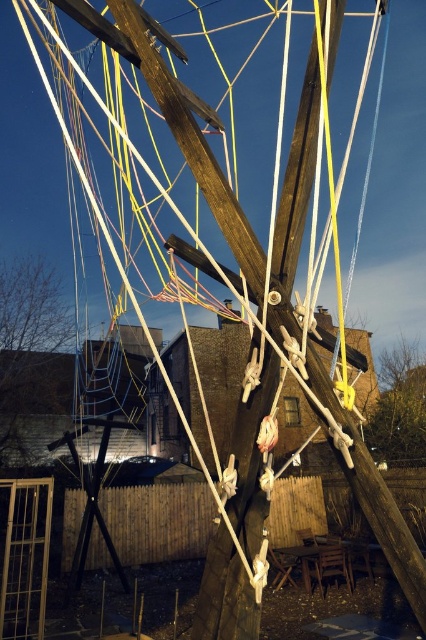
Question: Is the position of green matte tree at lower left more distant than that of wooden swing at right?

Choices:
 (A) no
 (B) yes

Answer: (B)

Question: Is green matte tree at lower left to the right of wooden swing at right from the viewer's perspective?

Choices:
 (A) yes
 (B) no

Answer: (B)

Question: Can you confirm if green matte tree at lower left is smaller than wooden swing at right?

Choices:
 (A) yes
 (B) no

Answer: (A)

Question: Among these points, which one is farthest from the camera?

Choices:
 (A) (386, 429)
 (B) (25, 289)

Answer: (B)